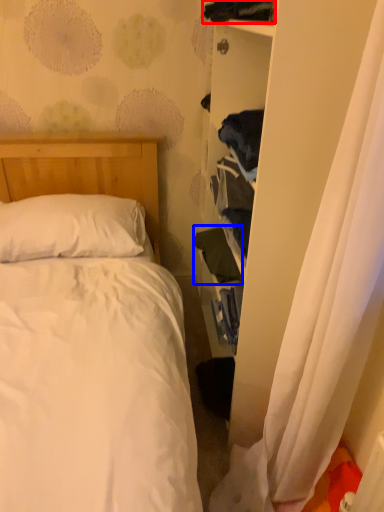
Question: Which object appears closest to the camera in this image, clothing (highlighted by a red box) or clothing (highlighted by a blue box)?

Choices:
 (A) clothing
 (B) clothing

Answer: (A)